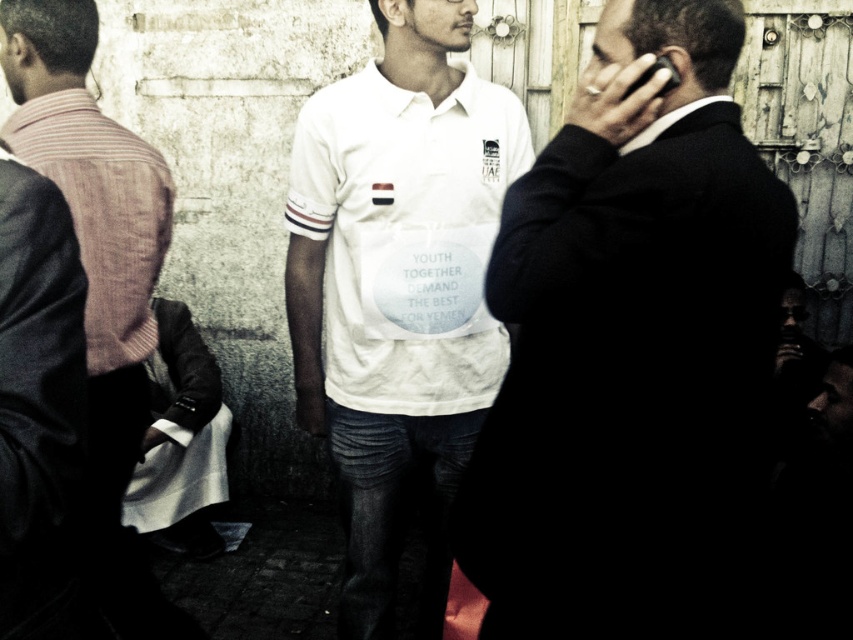
Based on the photo, does white cotton shirt at center appear on the right side of striped fabric shirt at left?

Indeed, white cotton shirt at center is positioned on the right side of striped fabric shirt at left.

Who is more forward, (430,218) or (21,74)?

Point (21,74) is more forward.

At what (x,y) coordinates should I click in order to perform the action: click on white cotton shirt at center. Please return your answer as a coordinate pair (x, y). The width and height of the screenshot is (853, 640). Looking at the image, I should click on (398, 288).

Is the position of black suit at center less distant than that of striped fabric shirt at left?

Yes, it is.

Can you confirm if black suit at center is taller than striped fabric shirt at left?

No, black suit at center is not taller than striped fabric shirt at left.

At what (x,y) coordinates should I click in order to perform the action: click on black suit at center. Please return your answer as a coordinate pair (x, y). The height and width of the screenshot is (640, 853). Looking at the image, I should click on (630, 346).

Does black suit at center appear on the right side of white cotton shirt at center?

Correct, you'll find black suit at center to the right of white cotton shirt at center.

Is point (743, 294) closer to viewer compared to point (500, 184)?

Yes, point (743, 294) is closer to viewer.

You are a GUI agent. You are given a task and a screenshot of the screen. Output one action in this format:
    pyautogui.click(x=<x>, y=<y>)
    Task: Click on the black suit at center
    Image resolution: width=853 pixels, height=640 pixels.
    Given the screenshot: What is the action you would take?
    pyautogui.click(x=630, y=346)